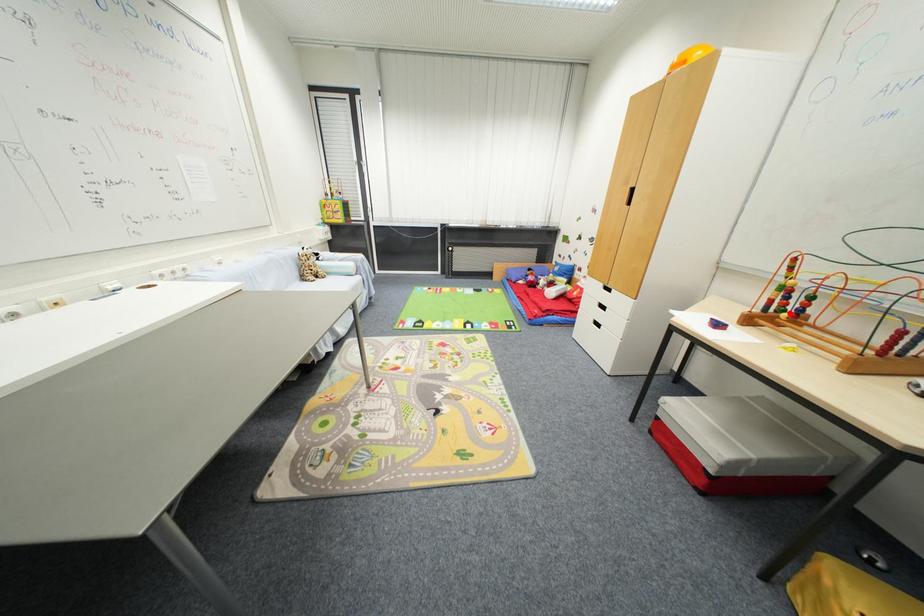
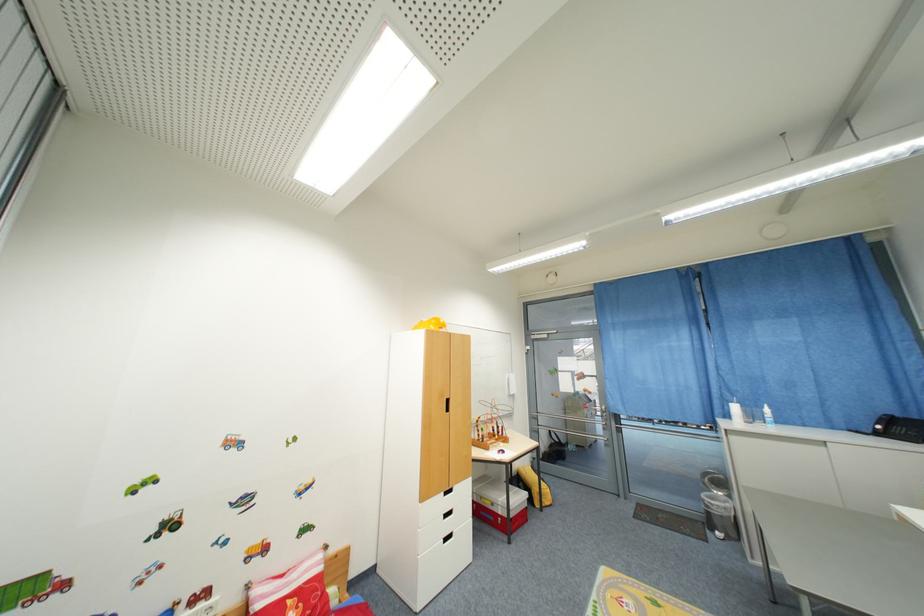
Question: I am providing you with two images of the same scene from different viewpoints. Given a red point in image1, look at the same physical point in image2. Is it:

Choices:
 (A) Closer to the viewpoint
 (B) Farther from the viewpoint

Answer: (B)